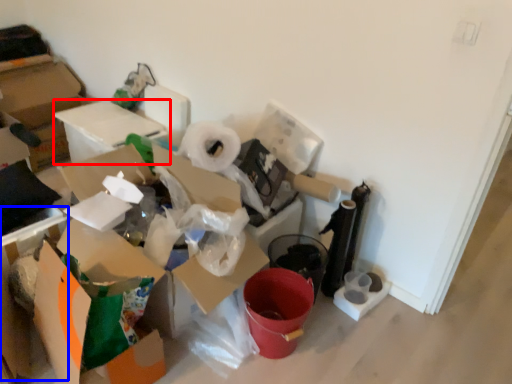
Question: Which of the following is the farthest to the observer, cardboard box (highlighted by a red box) or cardboard box (highlighted by a blue box)?

Choices:
 (A) cardboard box
 (B) cardboard box

Answer: (A)